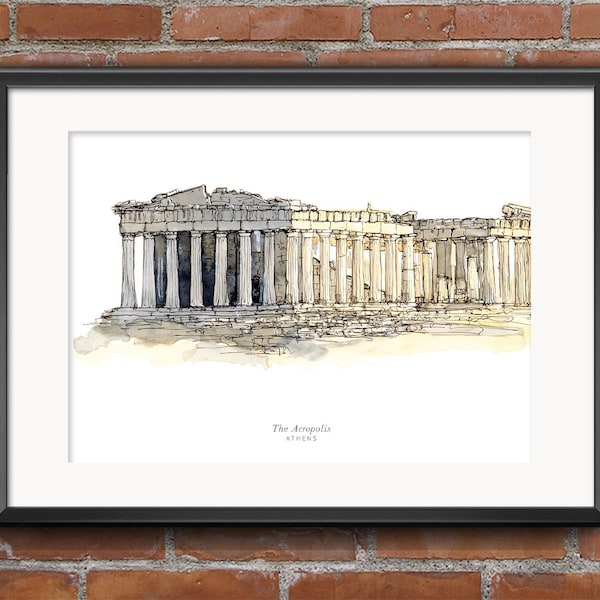
Locate an element on the screen. black picture frame is located at coordinates click(275, 519), click(2, 413), click(598, 211), click(335, 80).